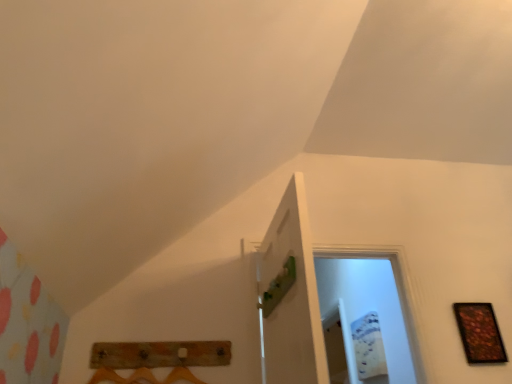
Question: Does green matte door at center lie in front of wooden picture frame at right?

Choices:
 (A) yes
 (B) no

Answer: (A)

Question: Considering the relative sizes of green matte door at center and wooden picture frame at right in the image provided, is green matte door at center thinner than wooden picture frame at right?

Choices:
 (A) yes
 (B) no

Answer: (B)

Question: Would you say green matte door at center is a long distance from wooden picture frame at right?

Choices:
 (A) yes
 (B) no

Answer: (A)

Question: From a real-world perspective, is green matte door at center located higher than wooden picture frame at right?

Choices:
 (A) no
 (B) yes

Answer: (B)

Question: Considering the relative sizes of green matte door at center and wooden picture frame at right in the image provided, is green matte door at center shorter than wooden picture frame at right?

Choices:
 (A) no
 (B) yes

Answer: (A)

Question: From a real-world perspective, relative to rustic wood coat rack at lower center, is green matte door at center vertically above or below?

Choices:
 (A) below
 (B) above

Answer: (B)

Question: Is green matte door at center taller or shorter than rustic wood coat rack at lower center?

Choices:
 (A) tall
 (B) short

Answer: (A)

Question: Which is correct: green matte door at center is inside rustic wood coat rack at lower center, or outside of it?

Choices:
 (A) outside
 (B) inside

Answer: (A)

Question: Is green matte door at center in front of or behind rustic wood coat rack at lower center in the image?

Choices:
 (A) behind
 (B) front

Answer: (B)

Question: From a real-world perspective, relative to wooden picture frame at right, is rustic wood coat rack at lower center vertically above or below?

Choices:
 (A) above
 (B) below

Answer: (B)

Question: Considering their positions, is rustic wood coat rack at lower center located in front of or behind wooden picture frame at right?

Choices:
 (A) behind
 (B) front

Answer: (B)

Question: Is rustic wood coat rack at lower center bigger or smaller than wooden picture frame at right?

Choices:
 (A) big
 (B) small

Answer: (A)

Question: From the image's perspective, is rustic wood coat rack at lower center above or below wooden picture frame at right?

Choices:
 (A) above
 (B) below

Answer: (A)

Question: Considering the positions of point (288, 327) and point (461, 316), is point (288, 327) closer or farther from the camera than point (461, 316)?

Choices:
 (A) closer
 (B) farther

Answer: (A)

Question: In terms of size, does green matte door at center appear bigger or smaller than wooden picture frame at right?

Choices:
 (A) big
 (B) small

Answer: (A)